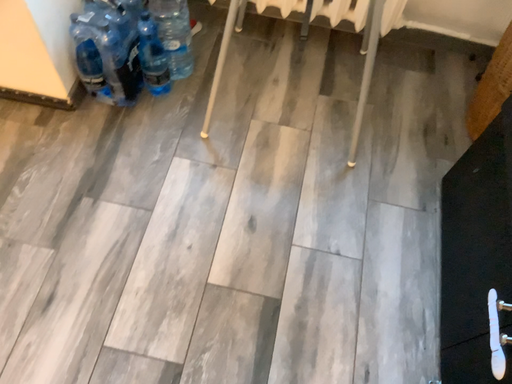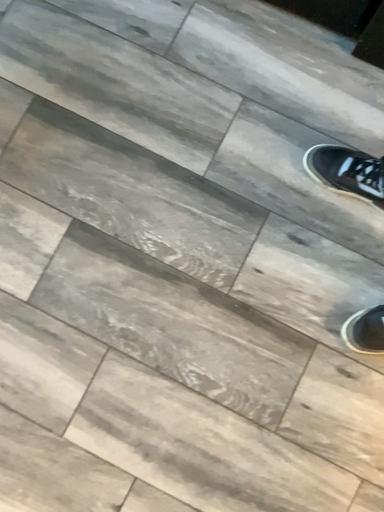
Question: How did the camera likely rotate when shooting the video?

Choices:
 (A) rotated right
 (B) rotated left

Answer: (A)